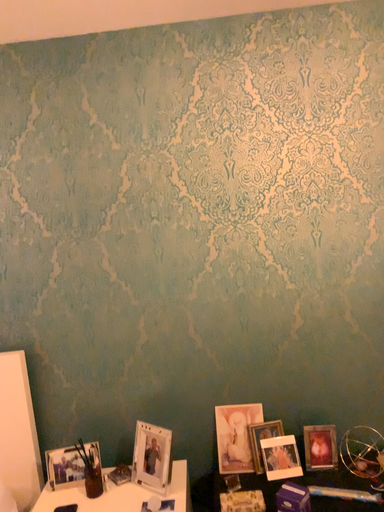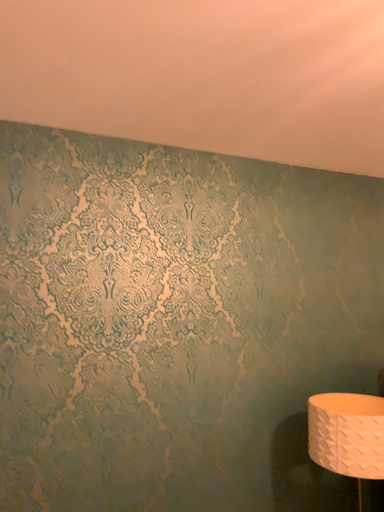
Question: How did the camera likely rotate when shooting the video?

Choices:
 (A) rotated downward
 (B) rotated upward

Answer: (B)